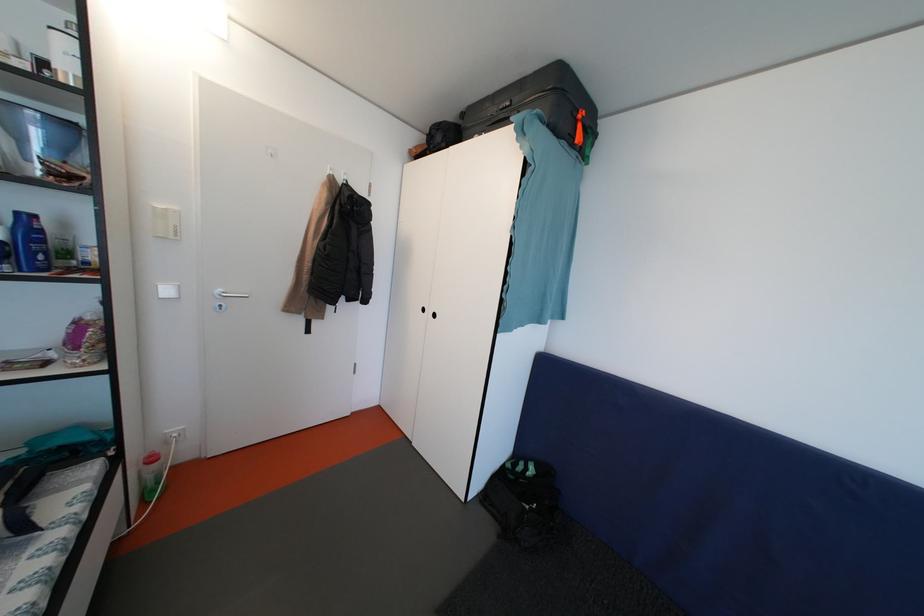
Describe the element at coordinates (497, 103) in the screenshot. I see `the suitcase side handle` at that location.